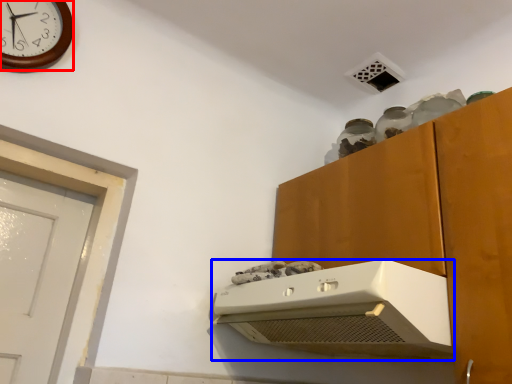
Question: Which point is further to the camera, wall clock (highlighted by a red box) or home appliance (highlighted by a blue box)?

Choices:
 (A) wall clock
 (B) home appliance

Answer: (A)